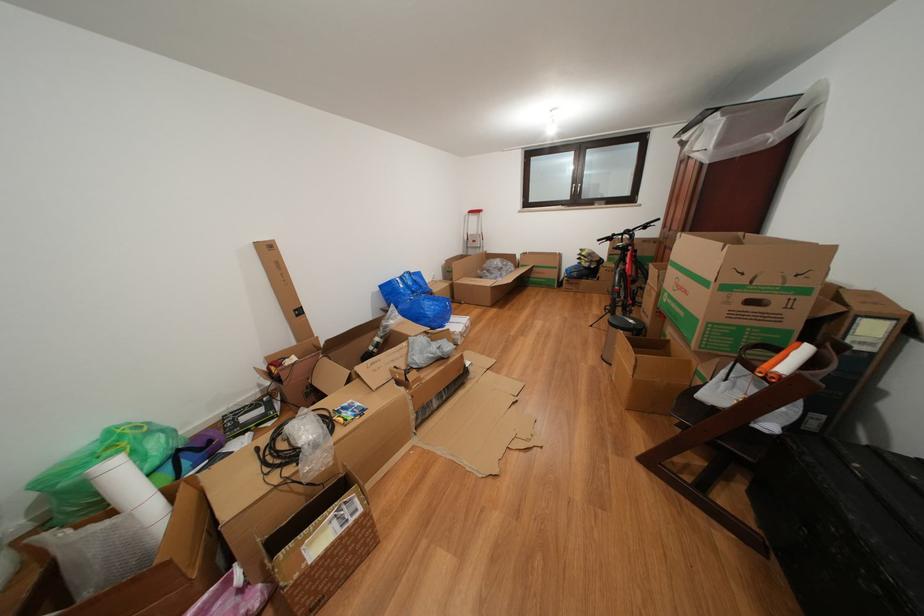
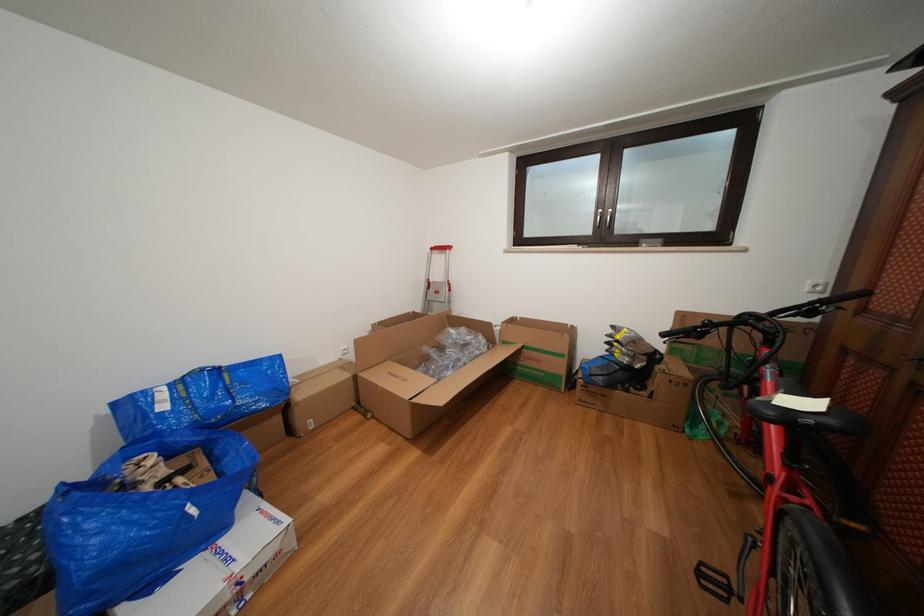
Where in the second image is the point corresponding to (564,273) from the first image?

(570, 361)